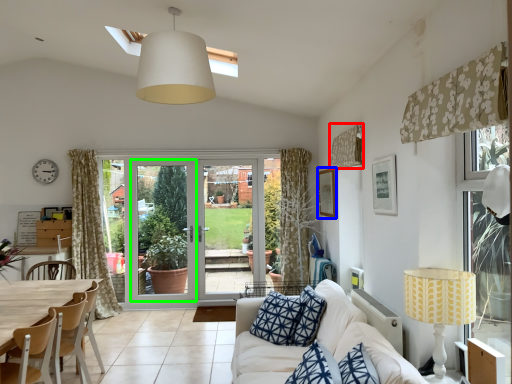
Question: Which is farther away from curtain (highlighted by a red box)? picture frame (highlighted by a blue box) or screen door (highlighted by a green box)?

Choices:
 (A) picture frame
 (B) screen door

Answer: (B)